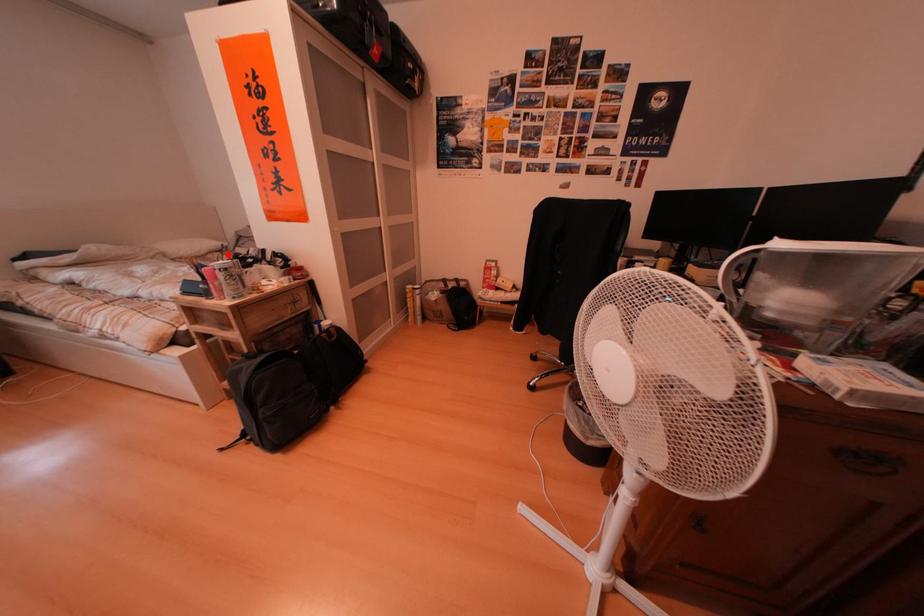
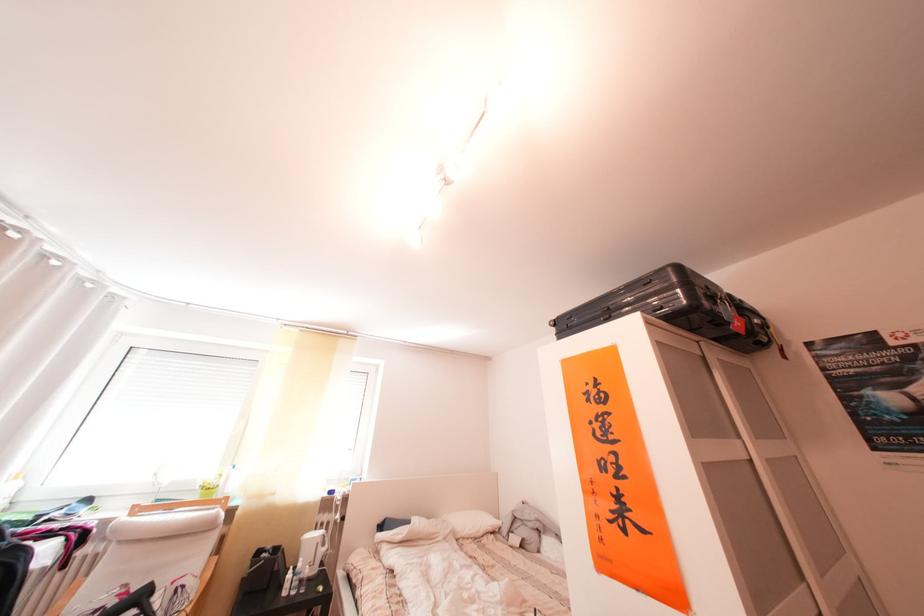
Question: I am providing you with two images of the same scene from different viewpoints. A red point is shown in image1. For the corresponding object point in image2, is it positioned nearer or farther from the camera?

Choices:
 (A) Nearer
 (B) Farther

Answer: (A)